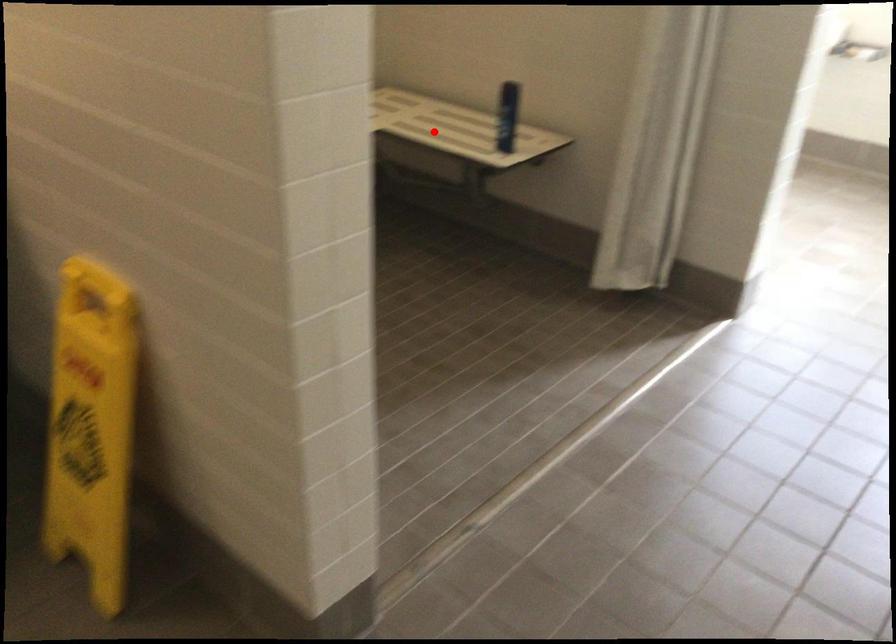
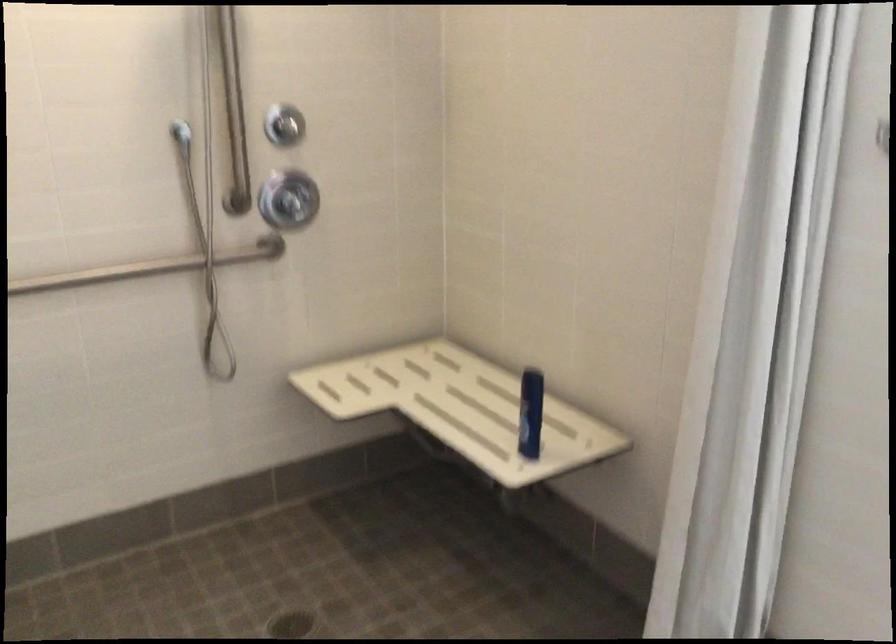
Where in the second image is the point corresponding to the highlighted location from the first image?

(460, 408)